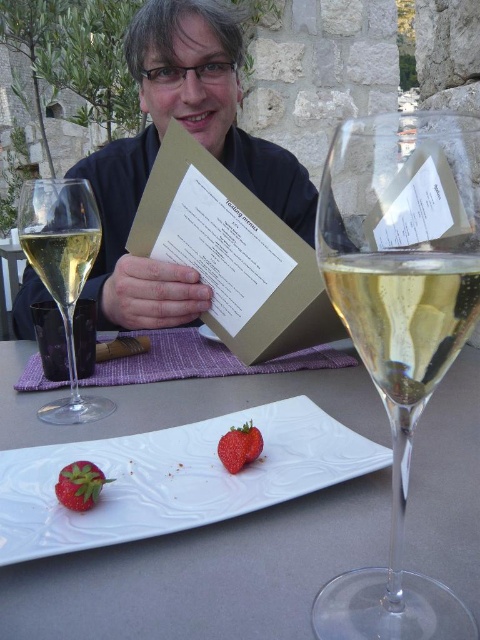
Is point (420, 339) farther from viewer compared to point (66, 412)?

No, it is not.

Is clear glass champagne at right smaller than clear glass wine glass at left?

Yes, clear glass champagne at right is smaller than clear glass wine glass at left.

Where is `clear glass champagne at right`? The image size is (480, 640). clear glass champagne at right is located at coordinates (406, 316).

Is point (31, 253) behind point (227, 464)?

That is True.

Who is more distant from viewer, [26,225] or [243,433]?

The point [26,225] is behind.

Find the location of `clear glass wine glass at left`. clear glass wine glass at left is located at coordinates (62, 272).

Is clear glass champagne at right to the left of clear glass champagne at left from the viewer's perspective?

Incorrect, clear glass champagne at right is not on the left side of clear glass champagne at left.

Does clear glass champagne at right have a greater width compared to clear glass champagne at left?

In fact, clear glass champagne at right might be narrower than clear glass champagne at left.

Locate an element on the screen. Image resolution: width=480 pixels, height=640 pixels. clear glass champagne at right is located at coordinates (406, 316).

What are the coordinates of `clear glass champagne at right` in the screenshot? It's located at [406, 316].